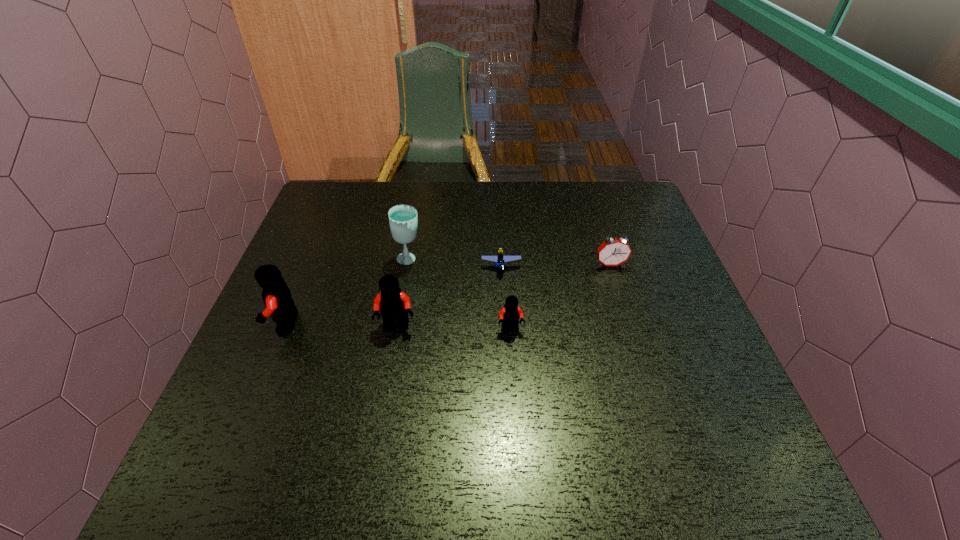
I want to click on vacant place for an extra Lego on the right, so click(626, 333).